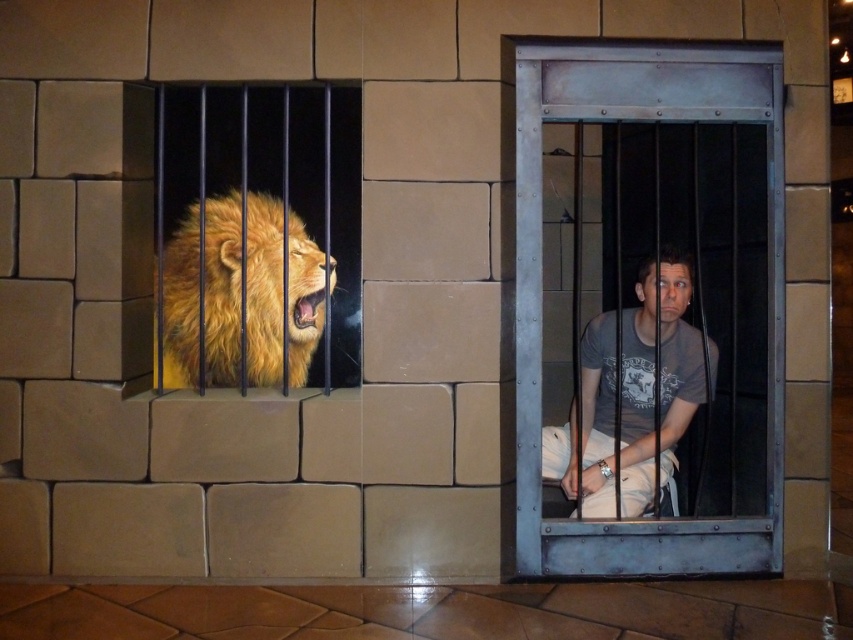
Question: Considering the real-world distances, which object is closest to the metallic steel bars at center?

Choices:
 (A) golden fur lion at left
 (B) matte gray t-shirt at center

Answer: (B)

Question: Which object appears farthest from the camera in this image?

Choices:
 (A) metallic steel bars at center
 (B) matte gray t-shirt at center
 (C) golden fur lion at left

Answer: (C)

Question: Can you confirm if metallic steel bars at center is positioned to the right of matte gray t-shirt at center?

Choices:
 (A) yes
 (B) no

Answer: (B)

Question: Is metallic steel bars at center to the left of golden fur lion at left from the viewer's perspective?

Choices:
 (A) yes
 (B) no

Answer: (B)

Question: Does golden fur lion at left appear under matte gray t-shirt at center?

Choices:
 (A) yes
 (B) no

Answer: (B)

Question: Estimate the real-world distances between objects in this image. Which object is farther from the matte gray t-shirt at center?

Choices:
 (A) metallic steel bars at center
 (B) golden fur lion at left

Answer: (B)